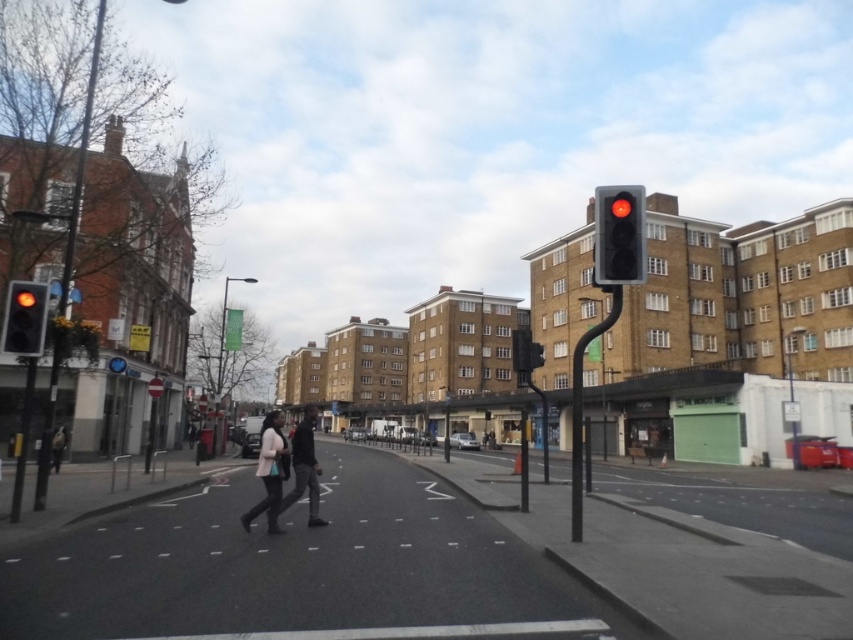
You are a pedestrian standing at the edge of the crosswalk and see both the matte black jacket at center and the dark gray fabric jacket at center. Which jacket is nearer to you?

The matte black jacket at center is closer to the viewer than the dark gray fabric jacket at center.

You are a delivery person who needs to cross the street at the pedestrian crossing. The traffic light is red, and you see the matte black traffic light at left and the dark gray fabric jacket at center. How far apart are these two objects?

The matte black traffic light at left and the dark gray fabric jacket at center are 9.32 meters apart.

You are a delivery person who needs to deliver a package to the address located on the dark gray fabric jacket at center. However, you notice the matte black traffic light at left might block your path. Based on the scene, can you determine if the traffic light is shorter than the jacket to ensure safe passage?

The matte black traffic light at left is not as tall as the dark gray fabric jacket at center, so the traffic light is shorter. This means it won should not block your path, allowing safe passage.